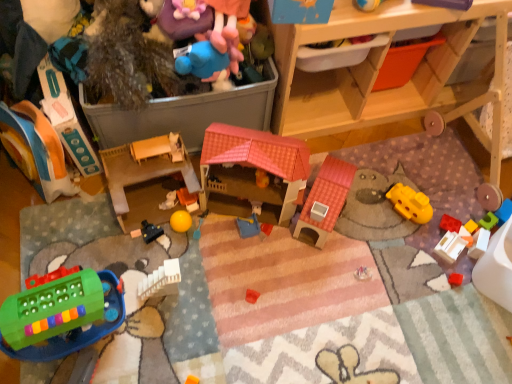
Question: Would you consider white plastic toy at lower right, positioned as the 4th toy in right-to-left order, to be distant from blue plush toy at upper center, the sixth toy positioned from the right?

Choices:
 (A) no
 (B) yes

Answer: (A)

Question: Does white plastic toy at lower right, positioned as the 4th toy in right-to-left order, appear on the left side of blue plush toy at upper center, which is the eighth toy in left-to-right order?

Choices:
 (A) no
 (B) yes

Answer: (A)

Question: Considering the relative sizes of white plastic toy at lower right, which is counted as the tenth toy, starting from the left, and blue plush toy at upper center, which is the eighth toy in left-to-right order, in the image provided, is white plastic toy at lower right, which is counted as the tenth toy, starting from the left, shorter than blue plush toy at upper center, which is the eighth toy in left-to-right order,?

Choices:
 (A) no
 (B) yes

Answer: (B)

Question: Is white plastic toy at lower right, which is counted as the tenth toy, starting from the left, behind blue plush toy at upper center, the sixth toy positioned from the right?

Choices:
 (A) yes
 (B) no

Answer: (A)

Question: Is white plastic toy at lower right, positioned as the 4th toy in right-to-left order, aimed at blue plush toy at upper center, which is the eighth toy in left-to-right order?

Choices:
 (A) no
 (B) yes

Answer: (A)

Question: Would you say green plastic building block at lower left, positioned as the 11th toy in right-to-left order, is to the left or to the right of matte plastic toy at left, the first toy when ordered from left to right, in the picture?

Choices:
 (A) right
 (B) left

Answer: (A)

Question: Does point (45, 286) appear closer or farther from the camera than point (5, 135)?

Choices:
 (A) closer
 (B) farther

Answer: (A)

Question: Is green plastic building block at lower left, positioned as the 11th toy in right-to-left order, in front of or behind matte plastic toy at left, the first toy when ordered from left to right, in the image?

Choices:
 (A) behind
 (B) front

Answer: (B)

Question: Is green plastic building block at lower left, positioned as the 11th toy in right-to-left order, spatially inside matte plastic toy at left, the first toy when ordered from left to right, or outside of it?

Choices:
 (A) outside
 (B) inside

Answer: (A)

Question: Based on their sizes in the image, would you say smooth plastic toy at center, the ninth toy viewed from the right, is bigger or smaller than yellow rubber ball at center, the 6th toy from the left?

Choices:
 (A) small
 (B) big

Answer: (A)

Question: From the image's perspective, relative to yellow rubber ball at center, arranged as the 8th toy when viewed from the right, is smooth plastic toy at center, the ninth toy viewed from the right, above or below?

Choices:
 (A) below
 (B) above

Answer: (B)

Question: Is point (170, 198) closer or farther from the camera than point (187, 228)?

Choices:
 (A) closer
 (B) farther

Answer: (B)

Question: From their relative heights in the image, would you say smooth plastic toy at center, the ninth toy viewed from the right, is taller or shorter than yellow rubber ball at center, arranged as the 8th toy when viewed from the right?

Choices:
 (A) short
 (B) tall

Answer: (A)

Question: Looking at their shapes, would you say white matte block at lower right, which is the 12th toy in left-to-right order, is wider or thinner than matte plastic toy at left, the second toy viewed from the left?

Choices:
 (A) wide
 (B) thin

Answer: (B)

Question: Considering the relative positions of white matte block at lower right, which is the 12th toy in left-to-right order, and matte plastic toy at left, which is counted as the 12th toy, starting from the right, in the image provided, is white matte block at lower right, which is the 12th toy in left-to-right order, to the left or to the right of matte plastic toy at left, which is counted as the 12th toy, starting from the right,?

Choices:
 (A) left
 (B) right

Answer: (B)